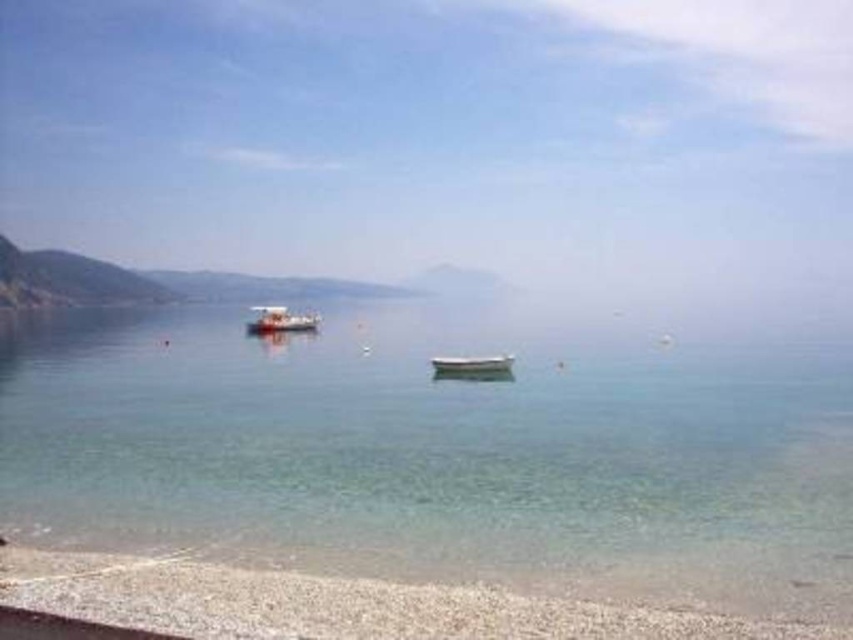
Question: Does clear water at center appear on the right side of white gravel beach at lower left?

Choices:
 (A) yes
 (B) no

Answer: (B)

Question: Which object is the farthest from the metallic silver boat at left?

Choices:
 (A) clear water at center
 (B) white glossy boat at center

Answer: (B)

Question: Estimate the real-world distances between objects in this image. Which object is farther from the white gravel beach at lower left?

Choices:
 (A) white glossy boat at center
 (B) clear water at center
 (C) metallic silver boat at left

Answer: (C)

Question: From the image, what is the correct spatial relationship of metallic silver boat at left in relation to white glossy boat at center?

Choices:
 (A) right
 (B) left

Answer: (B)

Question: Is metallic silver boat at left thinner than white glossy boat at center?

Choices:
 (A) yes
 (B) no

Answer: (B)

Question: Estimate the real-world distances between objects in this image. Which object is farther from the white gravel beach at lower left?

Choices:
 (A) white glossy boat at center
 (B) metallic silver boat at left

Answer: (B)